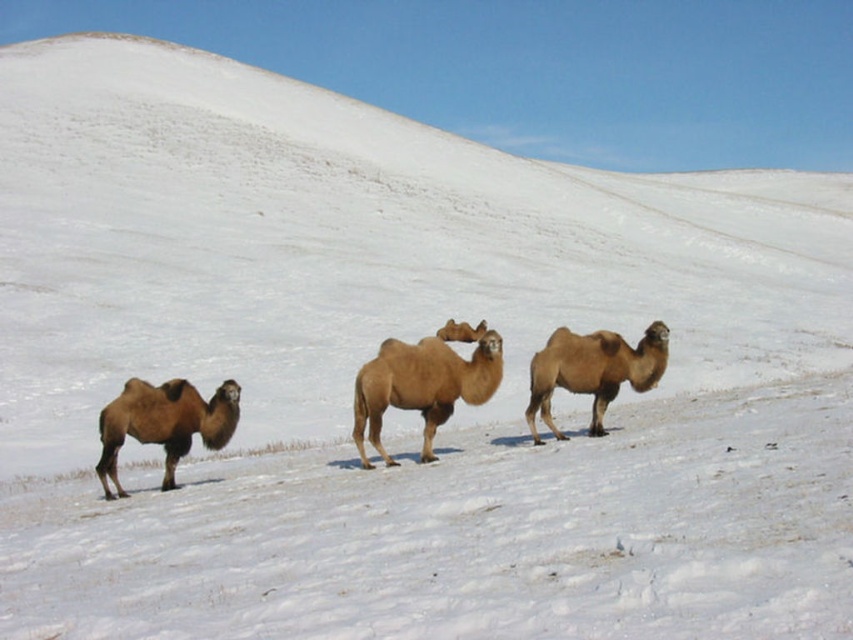
Question: Is brown fuzzy camel at left smaller than light brown fur camel at center?

Choices:
 (A) no
 (B) yes

Answer: (B)

Question: Which object is positioned farthest from the brown fuzzy camel at left?

Choices:
 (A) light brown fur camel at center
 (B) light brown woolen camel at center
 (C) light brown fur camel at right

Answer: (A)

Question: Considering the relative positions of brown fuzzy camel at left and light brown fur camel at right in the image provided, where is brown fuzzy camel at left located with respect to light brown fur camel at right?

Choices:
 (A) below
 (B) above

Answer: (A)

Question: Based on their relative distances, which object is nearer to the light brown fur camel at right?

Choices:
 (A) light brown fur camel at center
 (B) brown fuzzy camel at left

Answer: (B)

Question: Where is light brown woolen camel at center located in relation to light brown fur camel at center in the image?

Choices:
 (A) below
 (B) above

Answer: (A)

Question: Which point is closer to the camera taking this photo?

Choices:
 (A) (643, 374)
 (B) (469, 326)
 (C) (456, 397)
 (D) (209, 429)

Answer: (D)